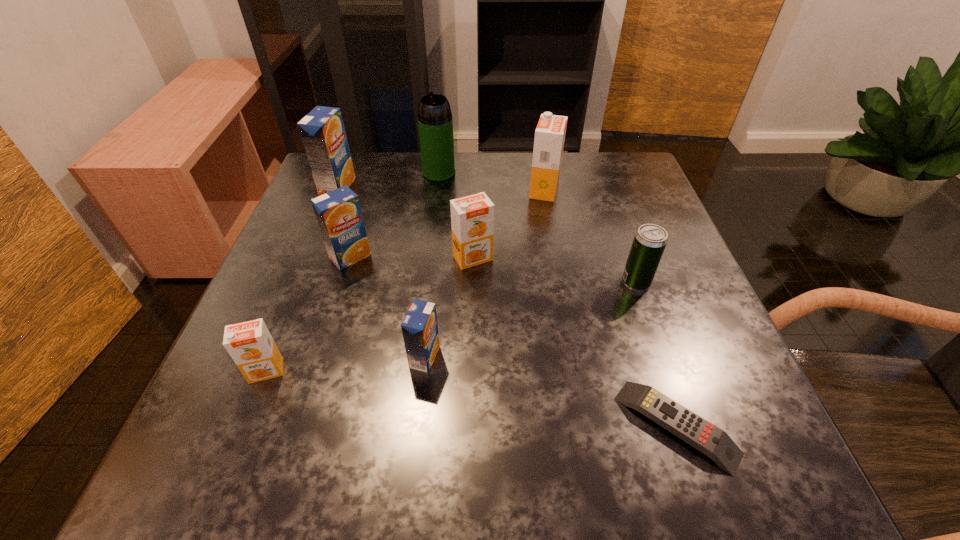
Identify the location of free space that is in between the sixth farthest object and the third object from right to left. (590, 237).

Image resolution: width=960 pixels, height=540 pixels. Identify the location of free area in between the second orange orange juice from left to right and the fourth nearest object. (554, 270).

Identify the location of free space between the third orange juice from left to right and the remote control. (514, 341).

This screenshot has height=540, width=960. Identify the location of vacant space in between the beer can and the tallest object. (538, 227).

In order to click on free point between the tallest object and the yellow remote control in this screenshot , I will do `click(558, 299)`.

The width and height of the screenshot is (960, 540). I want to click on free space between the second smallest blue orange_juice and the smallest orange orange juice, so click(308, 314).

This screenshot has height=540, width=960. I want to click on empty space that is in between the second orange orange juice from left to right and the leftmost orange orange juice, so click(370, 314).

The image size is (960, 540). I want to click on empty space that is in between the nearest blue orange_juice and the leftmost blue orange_juice, so click(381, 272).

At what (x,y) coordinates should I click in order to perform the action: click on vacant space in between the thermos bottle and the leftmost blue orange_juice. Please return your answer as a coordinate pair (x, y). This screenshot has height=540, width=960. Looking at the image, I should click on (388, 180).

The image size is (960, 540). Find the location of `object that ranks as the closest to the yellow remote control`. object that ranks as the closest to the yellow remote control is located at coordinates (650, 240).